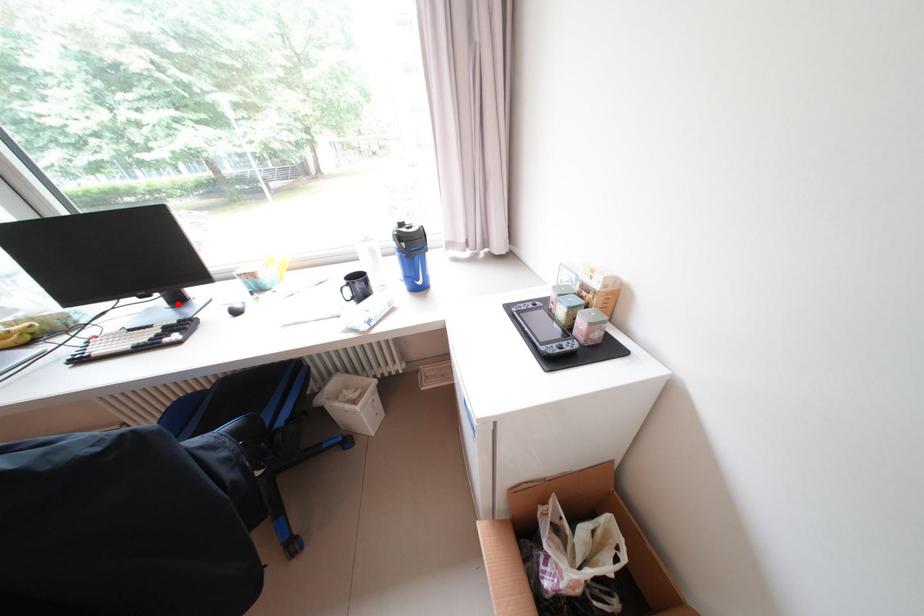
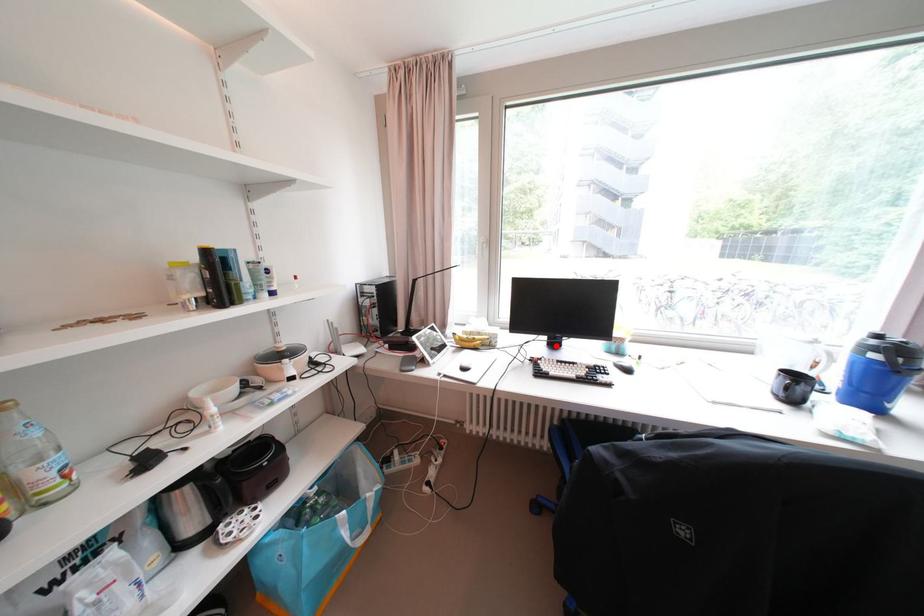
I am providing you with two images of the same scene from different viewpoints. A red point is marked on the first image and another point is marked on the second image. Are the points marked in image1 and image2 representing the same 3D position?

Yes